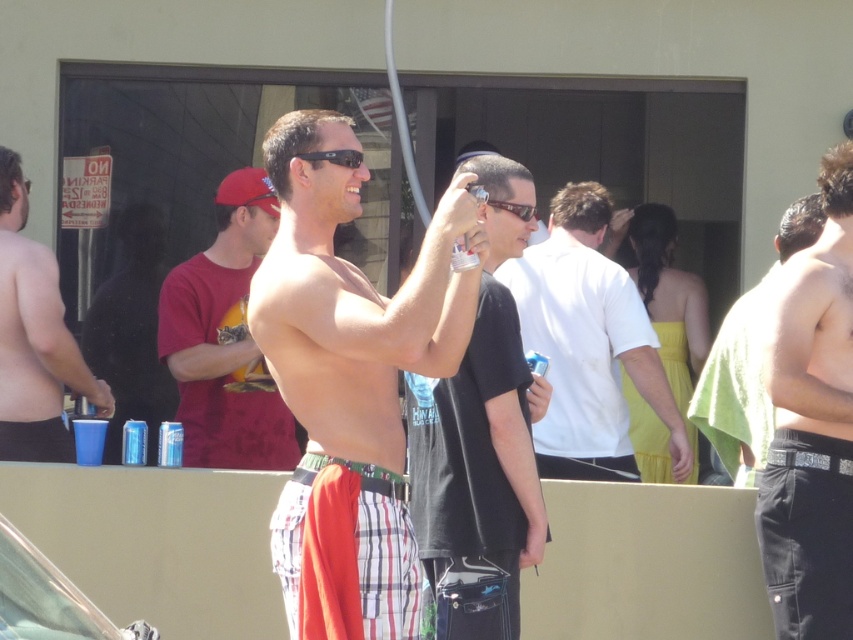
Question: Observing the image, what is the correct spatial positioning of black matte t-shirt at center in reference to matte plastic cup at left?

Choices:
 (A) left
 (B) right

Answer: (B)

Question: Does shiny red cap at center appear on the left side of matte plastic cup at left?

Choices:
 (A) no
 (B) yes

Answer: (A)

Question: Which object is positioned closest to the black leather pants at right?

Choices:
 (A) matte plastic cup at left
 (B) plaid fabric shorts at center
 (C) clear glass car at lower left

Answer: (B)

Question: Among these points, which one is nearest to the camera?

Choices:
 (A) (767, 428)
 (B) (323, 560)

Answer: (B)

Question: Does matte plastic cup at left have a greater width compared to shiny black hair at right?

Choices:
 (A) yes
 (B) no

Answer: (B)

Question: Which object is farther from the camera taking this photo?

Choices:
 (A) shiny black hair at right
 (B) shiny red cap at center

Answer: (B)